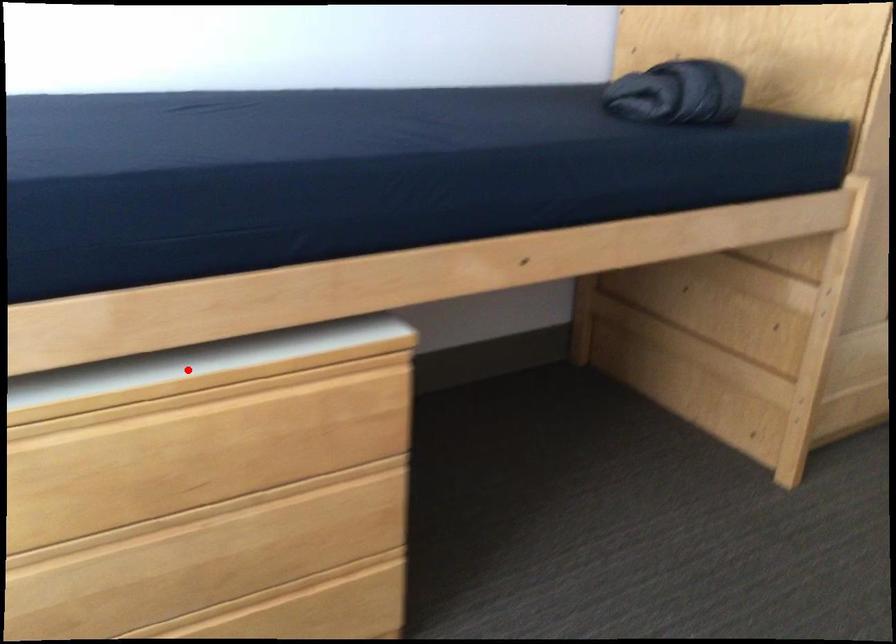
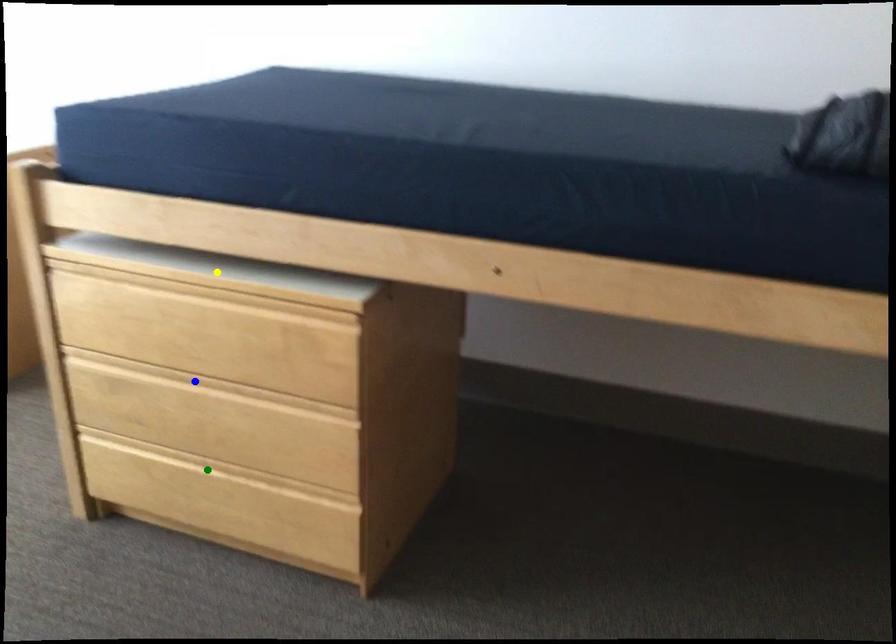
Question: I am providing you with two images of the same scene from different viewpoints. A red point is marked on the first image. You are given multiple points on the second image. Which point in image 2 is actually the same real-world point as the red point in image 1?

Choices:
 (A) yellow point
 (B) green point
 (C) blue point

Answer: (A)